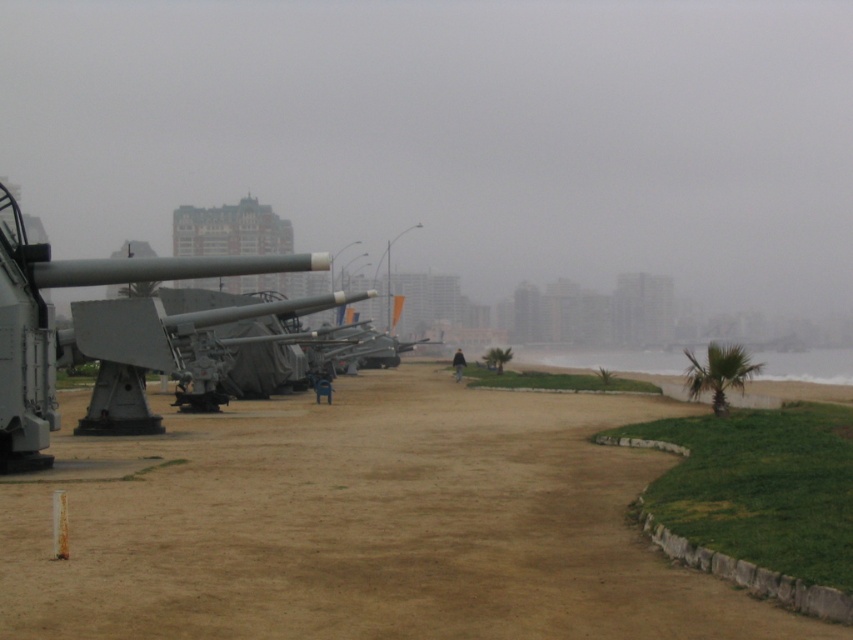
Can you confirm if brown sandy dirt at center is positioned to the right of gray metallic cannon at left?

Correct, you'll find brown sandy dirt at center to the right of gray metallic cannon at left.

Who is more forward, (x=807, y=618) or (x=212, y=321)?

Point (x=807, y=618)

The width and height of the screenshot is (853, 640). Find the location of `brown sandy dirt at center`. brown sandy dirt at center is located at coordinates (364, 524).